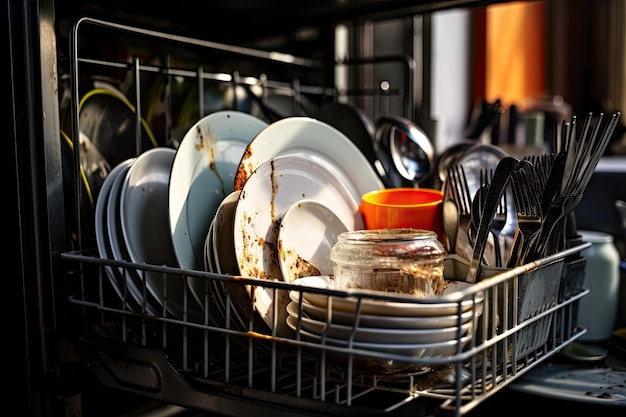
At what (x,y) coordinates should I click in order to perform the action: click on dishes with food on them. Please return your answer as a coordinate pair (x, y). Image resolution: width=626 pixels, height=417 pixels. Looking at the image, I should click on (196, 172), (269, 152), (275, 210), (305, 234).